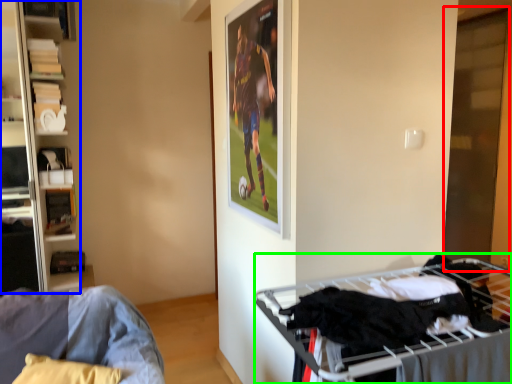
Question: Which object is positioned closest to glass door (highlighted by a red box)? Select from shelf (highlighted by a blue box) and bunk bed (highlighted by a green box).

Choices:
 (A) shelf
 (B) bunk bed

Answer: (B)